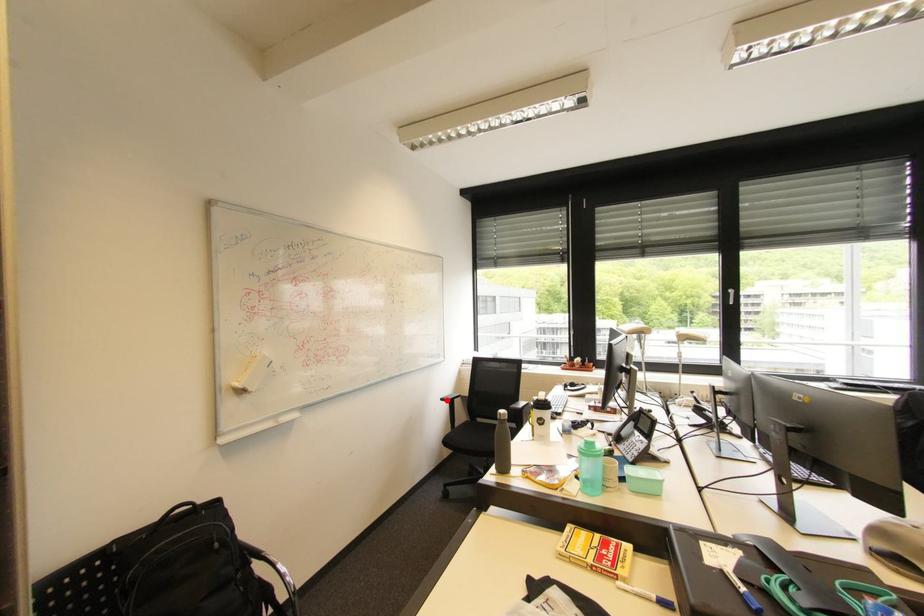
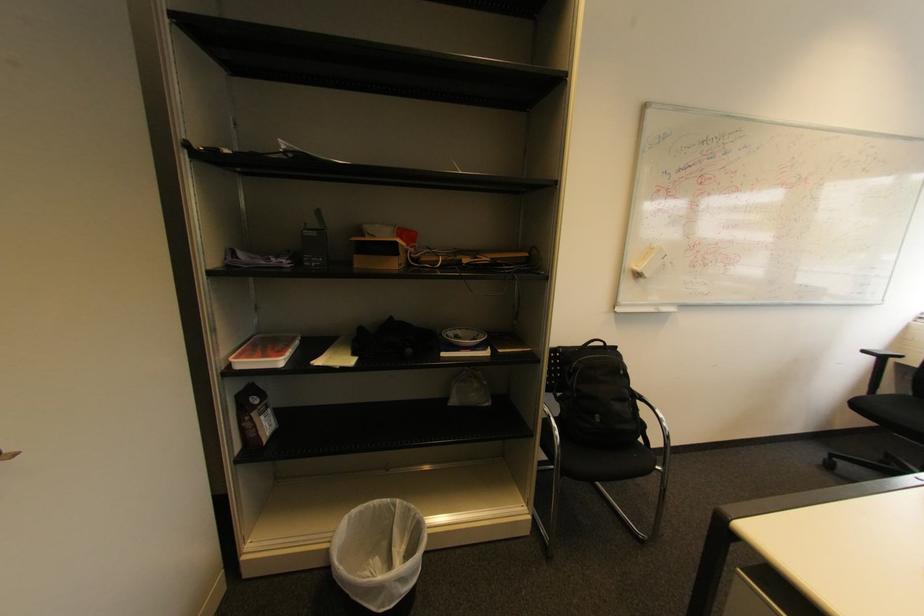
In the second image, find the point that corresponds to the highlighted location in the first image.

(869, 352)